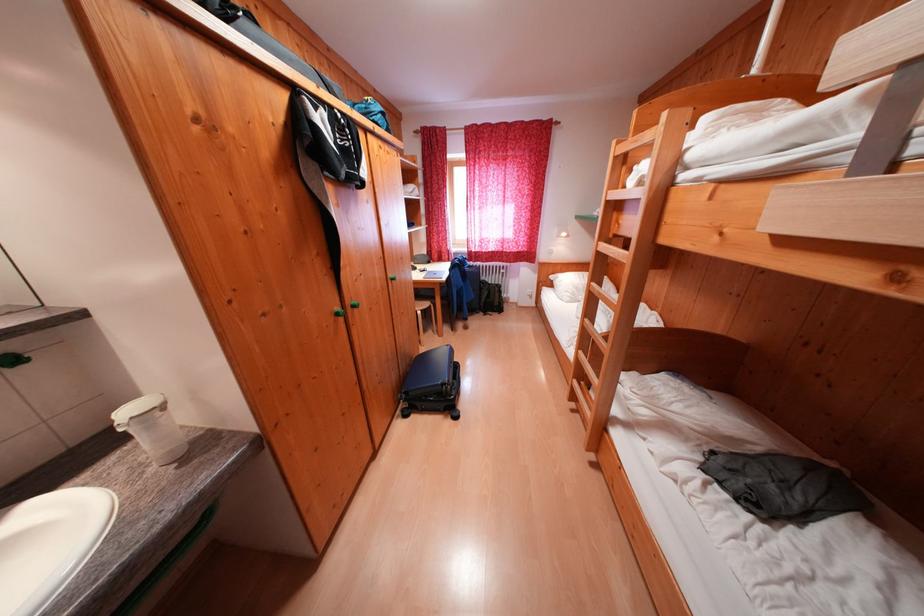
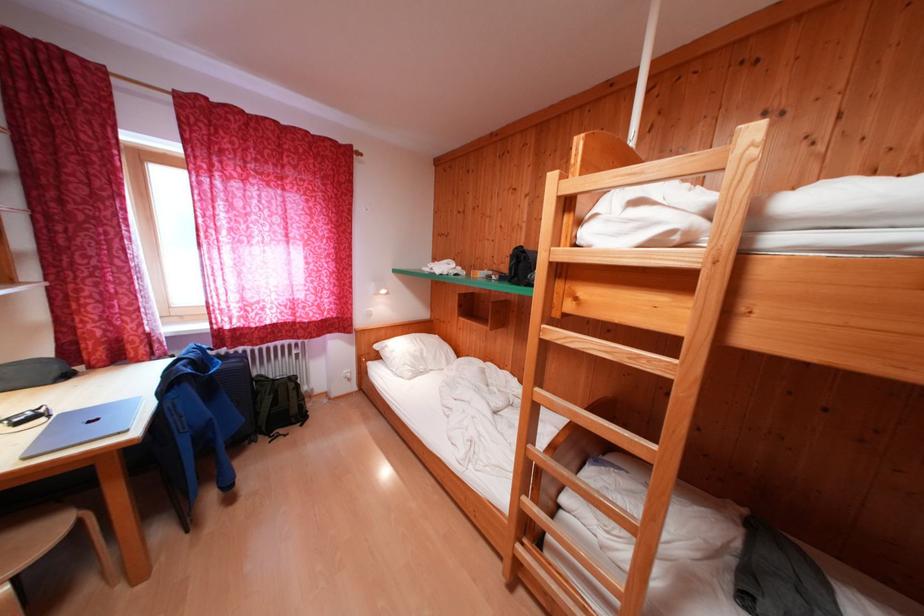
The point at (492, 286) is marked in the first image. Where is the corresponding point in the second image?

(271, 383)